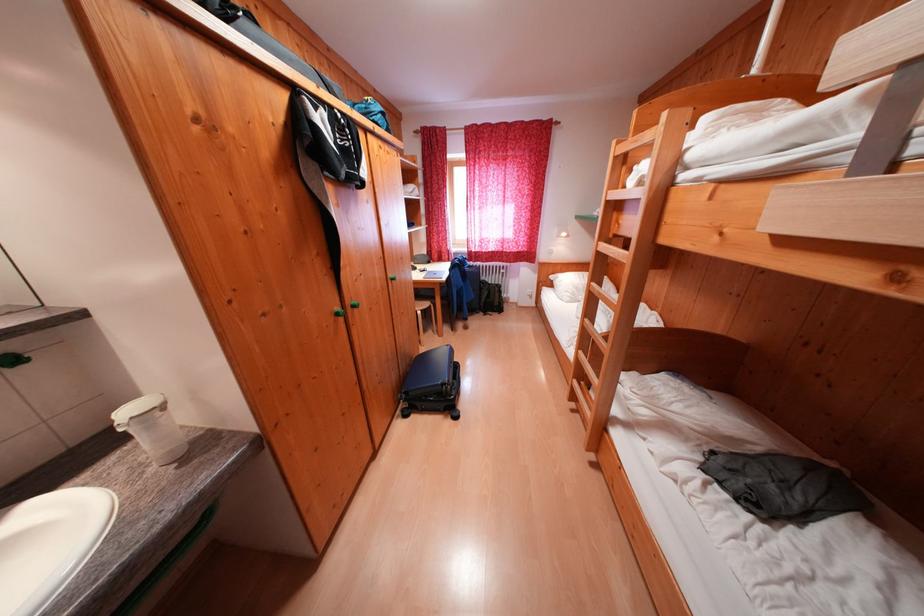
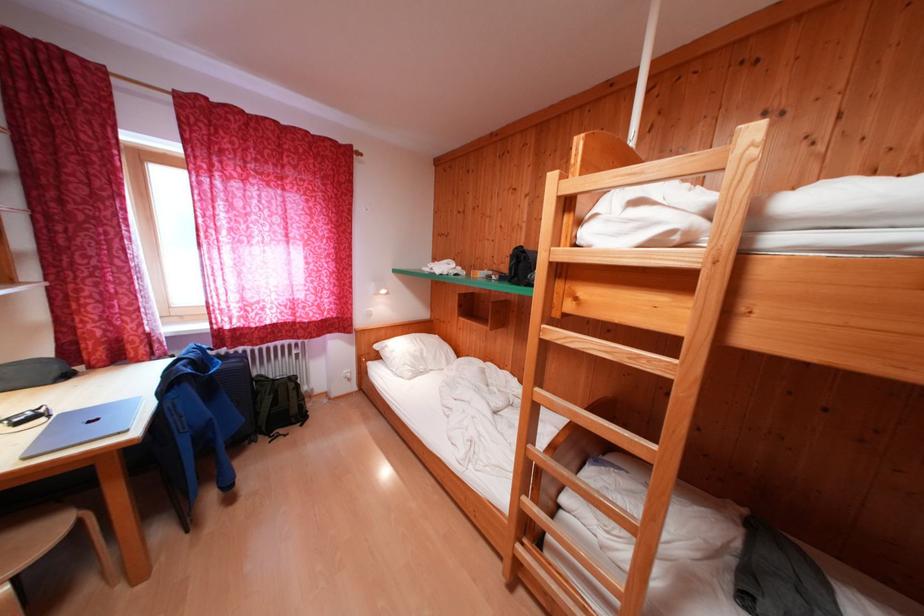
The point at (492, 286) is marked in the first image. Where is the corresponding point in the second image?

(271, 383)